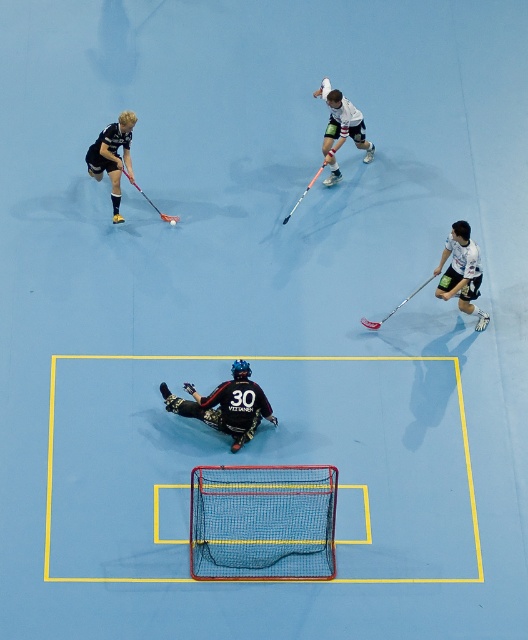
Does black matte goalie at center have a lesser height compared to metallic silver hockey stick at lower right?

In fact, black matte goalie at center may be taller than metallic silver hockey stick at lower right.

Between black matte goalie at center and metallic silver hockey stick at lower right, which one is positioned lower?

black matte goalie at center

Image resolution: width=528 pixels, height=640 pixels. What do you see at coordinates (225, 404) in the screenshot?
I see `black matte goalie at center` at bounding box center [225, 404].

At what (x,y) coordinates should I click in order to perform the action: click on black matte goalie at center. Please return your answer as a coordinate pair (x, y). This screenshot has height=640, width=528. Looking at the image, I should click on coord(225,404).

Does white matte hockey stick at right appear on the right side of orange metallic hockey stick at center?

Indeed, white matte hockey stick at right is positioned on the right side of orange metallic hockey stick at center.

Between white matte hockey stick at right and orange metallic hockey stick at center, which one is positioned lower?

white matte hockey stick at right is below.

Is point (473, 248) farther from viewer compared to point (296, 202)?

That is False.

You are a GUI agent. You are given a task and a screenshot of the screen. Output one action in this format:
    pyautogui.click(x=<x>, y=<y>)
    Task: Click on the white matte hockey stick at right
    
    Given the screenshot: What is the action you would take?
    pyautogui.click(x=462, y=273)

Which is above, black matte hockey stick at upper left or matte black hockey stick at upper left?

black matte hockey stick at upper left

Is black matte hockey stick at upper left bigger than matte black hockey stick at upper left?

Indeed, black matte hockey stick at upper left has a larger size compared to matte black hockey stick at upper left.

Locate an element on the screen. The width and height of the screenshot is (528, 640). black matte hockey stick at upper left is located at coordinates (111, 156).